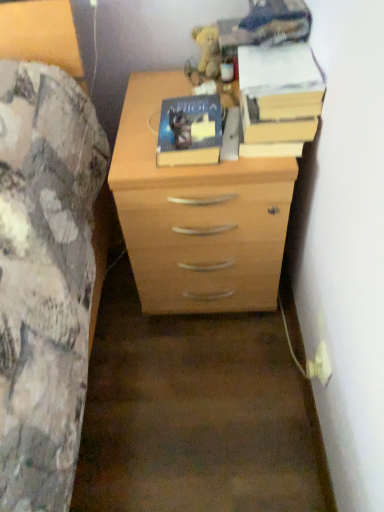
You are a GUI agent. You are given a task and a screenshot of the screen. Output one action in this format:
    pyautogui.click(x=<x>, y=<y>)
    Task: Click on the free point behind hardcover book at center, which appears as the 2th paperback book when viewed from the right
    The width and height of the screenshot is (384, 512).
    Given the screenshot: What is the action you would take?
    pyautogui.click(x=168, y=97)